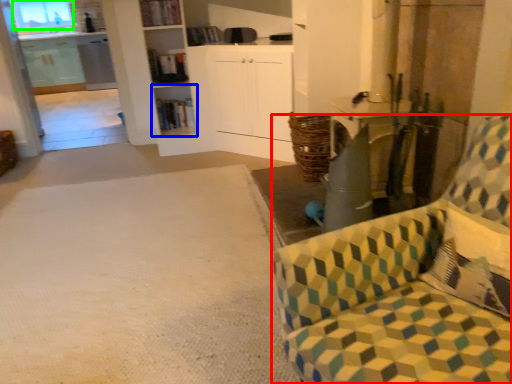
Question: Which object is positioned closest to chair (highlighted by a red box)? Select from shelf (highlighted by a blue box) and window (highlighted by a green box).

Choices:
 (A) shelf
 (B) window

Answer: (A)